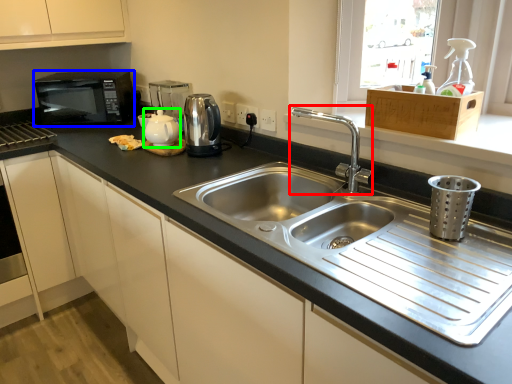
Question: Based on their relative distances, which object is nearer to tap (highlighted by a red box)? Choose from microwave oven (highlighted by a blue box) and tea pot (highlighted by a green box).

Choices:
 (A) microwave oven
 (B) tea pot

Answer: (B)